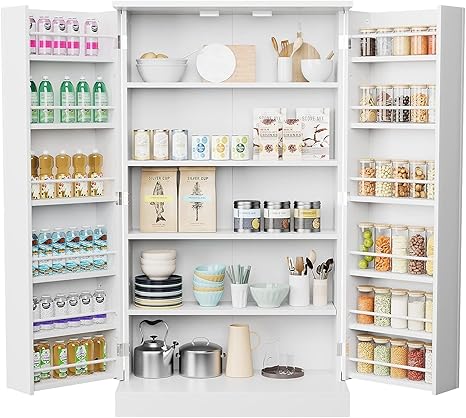
Identify the location of bottles on 3rd shelf on left side. This screenshot has width=466, height=418. (95, 163), (78, 163), (62, 165), (48, 165), (34, 165).